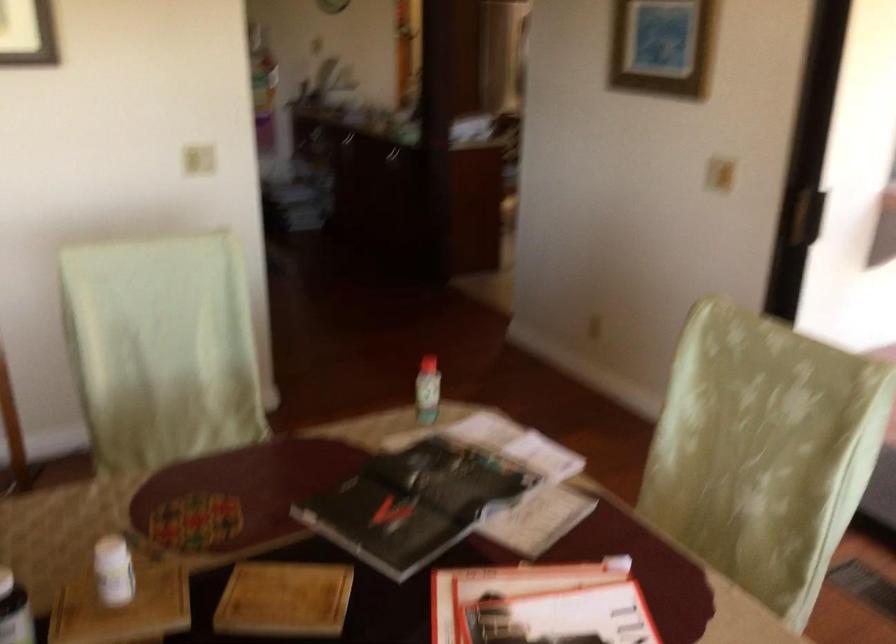
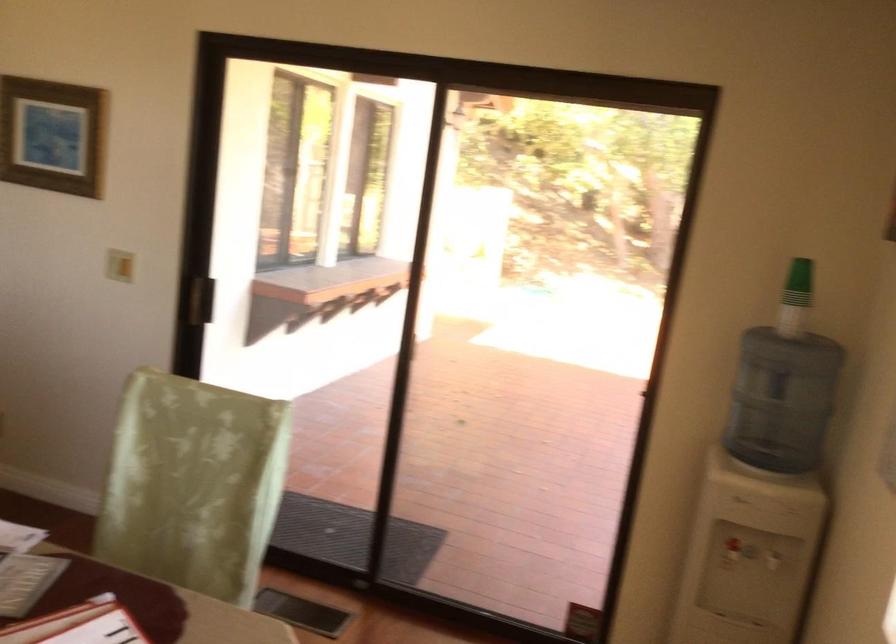
The point at (727, 180) is marked in the first image. Where is the corresponding point in the second image?

(119, 265)